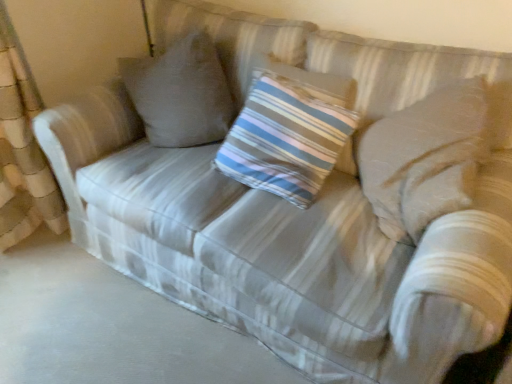
Question: Should I look upward or downward to see striped fabric pillow at center?

Choices:
 (A) up
 (B) down

Answer: (A)